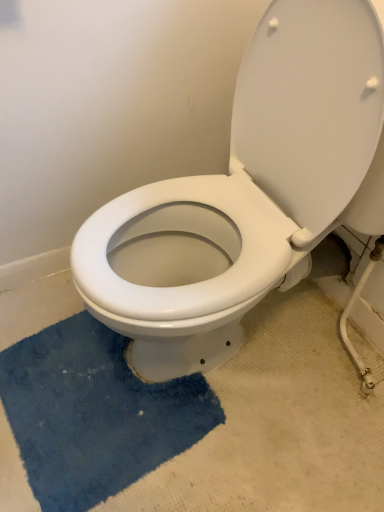
Question: From a real-world perspective, is white glossy toilet at center on blue plush bath mat at lower left?

Choices:
 (A) yes
 (B) no

Answer: (A)

Question: Does white glossy toilet at center have a greater height compared to blue plush bath mat at lower left?

Choices:
 (A) no
 (B) yes

Answer: (B)

Question: Is white glossy toilet at center aimed at blue plush bath mat at lower left?

Choices:
 (A) yes
 (B) no

Answer: (B)

Question: From a real-world perspective, is white glossy toilet at center beneath blue plush bath mat at lower left?

Choices:
 (A) no
 (B) yes

Answer: (A)

Question: Is white glossy toilet at center further to camera compared to blue plush bath mat at lower left?

Choices:
 (A) yes
 (B) no

Answer: (B)

Question: Is white glossy toilet at center positioned far away from blue plush bath mat at lower left?

Choices:
 (A) no
 (B) yes

Answer: (A)

Question: Is blue plush bath mat at lower left positioned beyond the bounds of white glossy toilet at center?

Choices:
 (A) no
 (B) yes

Answer: (B)

Question: Can you confirm if blue plush bath mat at lower left is positioned to the right of white glossy toilet at center?

Choices:
 (A) no
 (B) yes

Answer: (A)

Question: Does blue plush bath mat at lower left have a lesser width compared to white glossy toilet at center?

Choices:
 (A) yes
 (B) no

Answer: (A)

Question: Is blue plush bath mat at lower left positioned far away from white glossy toilet at center?

Choices:
 (A) no
 (B) yes

Answer: (A)

Question: Can you confirm if blue plush bath mat at lower left is positioned to the left of white glossy toilet at center?

Choices:
 (A) yes
 (B) no

Answer: (A)

Question: Does blue plush bath mat at lower left have a greater height compared to white glossy toilet at center?

Choices:
 (A) no
 (B) yes

Answer: (A)

Question: From a real-world perspective, is white glossy toilet at center above or below blue plush bath mat at lower left?

Choices:
 (A) above
 (B) below

Answer: (A)